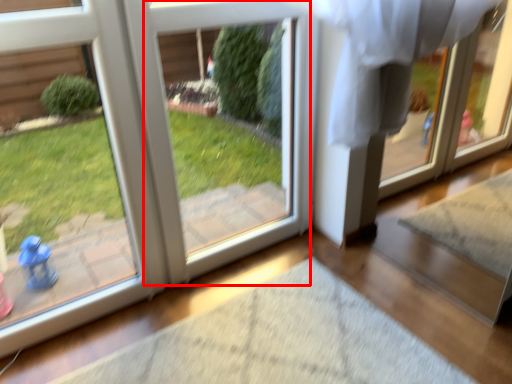
Question: From the image's perspective, what is the correct spatial positioning of screen door (annotated by the red box) in reference to door?

Choices:
 (A) above
 (B) below

Answer: (A)